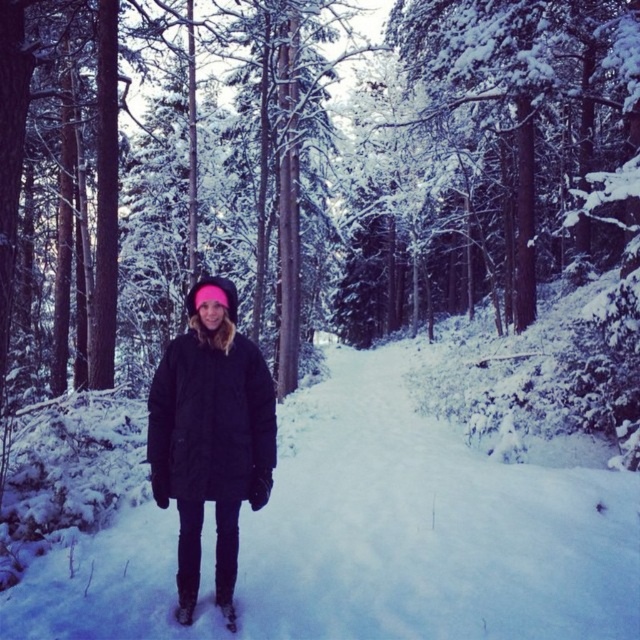
Who is more distant from viewer, (483, 476) or (253, 385)?

The point (483, 476) is more distant.

Who is more forward, (573,528) or (243,420)?

Point (243,420)

In order to click on white fluffy snow at center in this screenshot , I will do `click(371, 536)`.